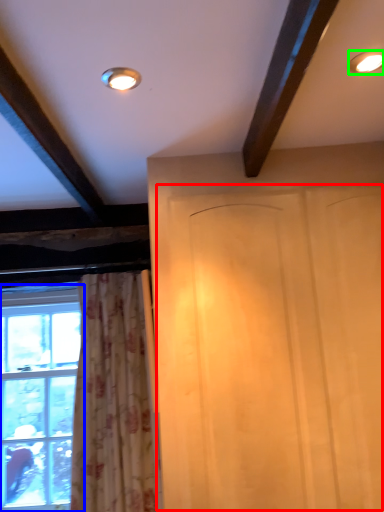
Question: Estimate the real-world distances between objects in this image. Which object is closer to screen door (highlighted by a red box), window (highlighted by a blue box) or lighting (highlighted by a green box)?

Choices:
 (A) window
 (B) lighting

Answer: (B)